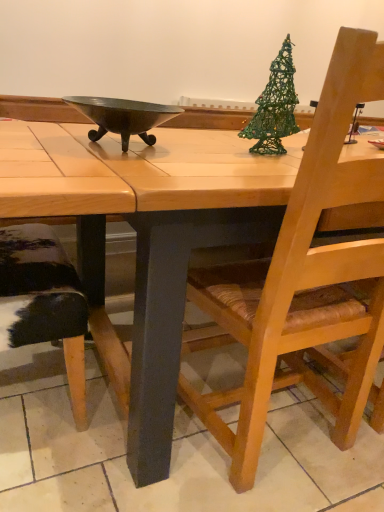
Question: From a real-world perspective, is wooden table at center over wooden chair with woven seat at right?

Choices:
 (A) yes
 (B) no

Answer: (B)

Question: Does wooden table at center have a greater width compared to wooden chair with woven seat at right?

Choices:
 (A) no
 (B) yes

Answer: (B)

Question: Is wooden table at center positioned with its back to wooden chair with woven seat at right?

Choices:
 (A) no
 (B) yes

Answer: (B)

Question: Is wooden table at center at the left side of wooden chair with woven seat at right?

Choices:
 (A) no
 (B) yes

Answer: (A)

Question: Is wooden table at center behind wooden chair with woven seat at right?

Choices:
 (A) no
 (B) yes

Answer: (A)

Question: Would you say wooden table at center is outside wooden chair with woven seat at right?

Choices:
 (A) no
 (B) yes

Answer: (B)

Question: Does metallic dark gray bowl at center have a smaller size compared to green wire christmas tree at upper right?

Choices:
 (A) no
 (B) yes

Answer: (B)

Question: Is metallic dark gray bowl at center far away from green wire christmas tree at upper right?

Choices:
 (A) no
 (B) yes

Answer: (A)

Question: Is metallic dark gray bowl at center at the left side of green wire christmas tree at upper right?

Choices:
 (A) no
 (B) yes

Answer: (B)

Question: Can you confirm if metallic dark gray bowl at center is positioned to the right of green wire christmas tree at upper right?

Choices:
 (A) yes
 (B) no

Answer: (B)

Question: Is the position of metallic dark gray bowl at center less distant than that of green wire christmas tree at upper right?

Choices:
 (A) no
 (B) yes

Answer: (B)

Question: Does metallic dark gray bowl at center come behind green wire christmas tree at upper right?

Choices:
 (A) yes
 (B) no

Answer: (B)

Question: Is green wire christmas tree at upper right at the left side of metallic dark gray bowl at center?

Choices:
 (A) no
 (B) yes

Answer: (A)